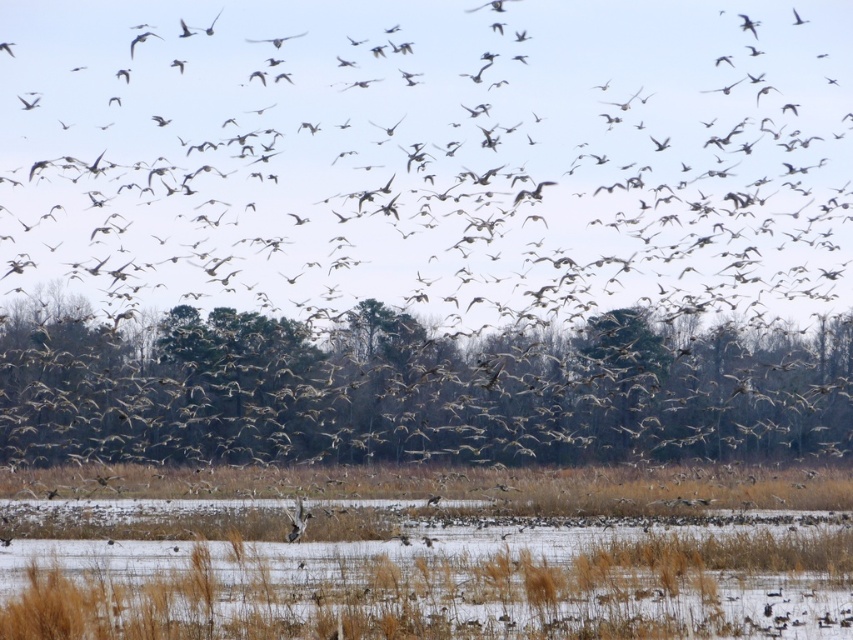
Does brown textured tree at center appear on the left side of brown feathered bird at upper left?

Incorrect, brown textured tree at center is not on the left side of brown feathered bird at upper left.

Where is `brown textured tree at center`? Image resolution: width=853 pixels, height=640 pixels. brown textured tree at center is located at coordinates (410, 390).

Does brown grass at lower center appear on the right side of brown textured tree at center?

Yes, brown grass at lower center is to the right of brown textured tree at center.

The height and width of the screenshot is (640, 853). What do you see at coordinates (427, 554) in the screenshot?
I see `brown grass at lower center` at bounding box center [427, 554].

This screenshot has height=640, width=853. What do you see at coordinates (427, 554) in the screenshot?
I see `brown grass at lower center` at bounding box center [427, 554].

Where is `brown grass at lower center`? brown grass at lower center is located at coordinates (427, 554).

Does brown feathered birds at center have a smaller size compared to brown textured tree at center?

No, brown feathered birds at center is not smaller than brown textured tree at center.

Between brown feathered birds at center and brown textured tree at center, which one is positioned lower?

brown textured tree at center

Does point (370, 17) come closer to viewer compared to point (643, 429)?

No, it is not.

Identify the location of brown feathered birds at center. (422, 220).